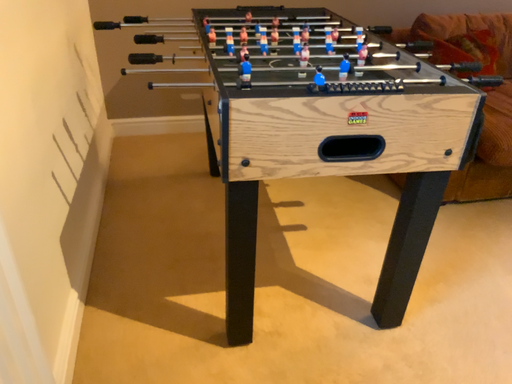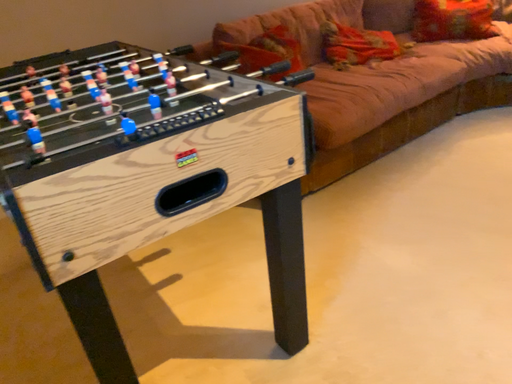
Question: Which way did the camera rotate in the video?

Choices:
 (A) rotated left
 (B) rotated right

Answer: (B)